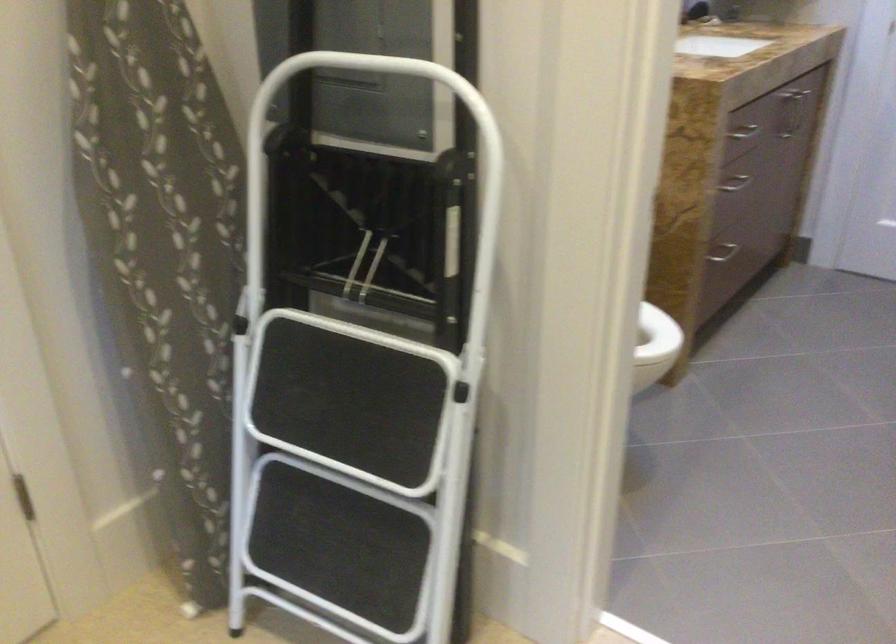
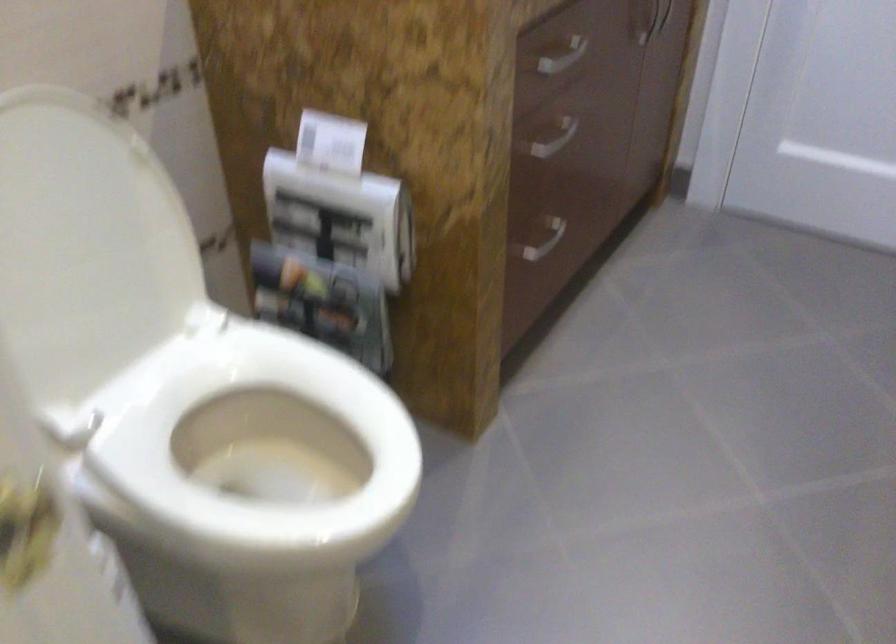
Locate, in the second image, the point that corresponds to (x=719, y=260) in the first image.

(538, 238)